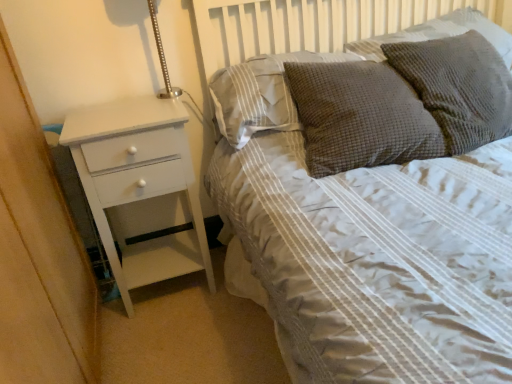
The image size is (512, 384). Describe the element at coordinates (458, 87) in the screenshot. I see `textured gray pillow at upper right, the 2th pillow positioned from the right` at that location.

Describe the element at coordinates (440, 34) in the screenshot. I see `textured gray pillow at upper right, the 1th pillow when ordered from right to left` at that location.

Describe the element at coordinates (260, 94) in the screenshot. I see `brown textured pillow at upper center, which is the 1th pillow from left to right` at that location.

Identify the location of white painted wood chest of drawers at left. (139, 183).

The height and width of the screenshot is (384, 512). What do you see at coordinates (360, 117) in the screenshot?
I see `brown textured pillow at upper right, which is the 3th pillow in right-to-left order` at bounding box center [360, 117].

Locate an element on the screen. This screenshot has width=512, height=384. textured gray pillow at upper right, the 2th pillow positioned from the right is located at coordinates [458, 87].

Is white painted wood chest of drawers at left facing towards brown textured pillow at upper center, which is the 1th pillow from left to right?

No, white painted wood chest of drawers at left does not turn towards brown textured pillow at upper center, which is the 1th pillow from left to right.

Does white painted wood chest of drawers at left lie behind brown textured pillow at upper center, which is the 1th pillow from left to right?

No, it is in front of brown textured pillow at upper center, which is the 1th pillow from left to right.

From a real-world perspective, is white painted wood chest of drawers at left located higher than brown textured pillow at upper center, which is counted as the fourth pillow, starting from the right?

No.

Which of these two, brown textured pillow at upper right, placed as the 2th pillow when sorted from left to right, or brown textured pillow at upper center, which is the 1th pillow from left to right, stands taller?

With more height is brown textured pillow at upper right, placed as the 2th pillow when sorted from left to right.

Consider the image. Is brown textured pillow at upper right, which is the 3th pillow in right-to-left order, to the left of brown textured pillow at upper center, which is counted as the fourth pillow, starting from the right, from the viewer's perspective?

Incorrect, brown textured pillow at upper right, which is the 3th pillow in right-to-left order, is not on the left side of brown textured pillow at upper center, which is counted as the fourth pillow, starting from the right.

Is point (415, 104) closer to camera compared to point (260, 125)?

Yes, it is in front of point (260, 125).

Considering the sizes of textured gray pillow at upper right, the 1th pillow when ordered from right to left, and textured gray pillow at upper right, the 2th pillow positioned from the right, in the image, is textured gray pillow at upper right, the 1th pillow when ordered from right to left, taller or shorter than textured gray pillow at upper right, the 2th pillow positioned from the right,?

Clearly, textured gray pillow at upper right, the 1th pillow when ordered from right to left, is shorter compared to textured gray pillow at upper right, the 2th pillow positioned from the right.

Does textured gray pillow at upper right, the 1th pillow when ordered from right to left, appear on the right side of textured gray pillow at upper right, the 2th pillow positioned from the right?

Correct, you'll find textured gray pillow at upper right, the 1th pillow when ordered from right to left, to the right of textured gray pillow at upper right, the 2th pillow positioned from the right.

Is point (454, 28) farther from camera compared to point (415, 88)?

Yes, it is.

How different are the orientations of textured gray pillow at upper right, the 4th pillow viewed from the left, and textured gray pillow at upper right, the 2th pillow positioned from the right, in degrees?

The angular difference between textured gray pillow at upper right, the 4th pillow viewed from the left, and textured gray pillow at upper right, the 2th pillow positioned from the right, is 7.82 degrees.

Which object is positioned more to the left, white painted wood chest of drawers at left or textured gray pillow at upper right, the 4th pillow viewed from the left?

white painted wood chest of drawers at left is more to the left.

Is white painted wood chest of drawers at left aimed at textured gray pillow at upper right, the 1th pillow when ordered from right to left?

No, white painted wood chest of drawers at left is not oriented towards textured gray pillow at upper right, the 1th pillow when ordered from right to left.

Is point (83, 114) more distant than point (471, 9)?

No.

Which of these two, white painted wood chest of drawers at left or textured gray pillow at upper right, the 4th pillow viewed from the left, stands shorter?

With less height is textured gray pillow at upper right, the 4th pillow viewed from the left.

Which of these two, brown textured pillow at upper center, which is counted as the fourth pillow, starting from the right, or textured gray pillow at upper right, positioned as the 3th pillow in left-to-right order, stands shorter?

brown textured pillow at upper center, which is counted as the fourth pillow, starting from the right.

Is brown textured pillow at upper center, which is counted as the fourth pillow, starting from the right, oriented away from textured gray pillow at upper right, positioned as the 3th pillow in left-to-right order?

No, brown textured pillow at upper center, which is counted as the fourth pillow, starting from the right, is not facing the opposite direction of textured gray pillow at upper right, positioned as the 3th pillow in left-to-right order.

Between point (290, 115) and point (410, 42), which one is positioned behind?

Positioned behind is point (290, 115).

Where is `the 2nd pillow counting from the right side of the brown textured pillow at upper center, which is counted as the fourth pillow, starting from the right`? Image resolution: width=512 pixels, height=384 pixels. the 2nd pillow counting from the right side of the brown textured pillow at upper center, which is counted as the fourth pillow, starting from the right is located at coordinates (458, 87).

Is brown textured pillow at upper center, which is the 1th pillow from left to right, looking in the opposite direction of brown textured pillow at upper right, which is the 3th pillow in right-to-left order?

No.

Is point (229, 95) positioned before point (390, 121)?

No.

Considering the sizes of objects brown textured pillow at upper center, which is the 1th pillow from left to right, and brown textured pillow at upper right, placed as the 2th pillow when sorted from left to right, in the image provided, who is thinner, brown textured pillow at upper center, which is the 1th pillow from left to right, or brown textured pillow at upper right, placed as the 2th pillow when sorted from left to right,?

brown textured pillow at upper center, which is the 1th pillow from left to right, is thinner.

In the image, is brown textured pillow at upper center, which is the 1th pillow from left to right, on the left side or the right side of brown textured pillow at upper right, which is the 3th pillow in right-to-left order?

In the image, brown textured pillow at upper center, which is the 1th pillow from left to right, appears on the left side of brown textured pillow at upper right, which is the 3th pillow in right-to-left order.

Is the position of brown textured pillow at upper right, which is the 3th pillow in right-to-left order, less distant than that of textured gray pillow at upper right, the 2th pillow positioned from the right?

No, the depth of brown textured pillow at upper right, which is the 3th pillow in right-to-left order, is greater than that of textured gray pillow at upper right, the 2th pillow positioned from the right.

Could you tell me if brown textured pillow at upper right, which is the 3th pillow in right-to-left order, is turned towards textured gray pillow at upper right, positioned as the 3th pillow in left-to-right order?

No, brown textured pillow at upper right, which is the 3th pillow in right-to-left order, is not oriented towards textured gray pillow at upper right, positioned as the 3th pillow in left-to-right order.

From the picture: Can you confirm if brown textured pillow at upper right, placed as the 2th pillow when sorted from left to right, is thinner than textured gray pillow at upper right, the 2th pillow positioned from the right?

No, brown textured pillow at upper right, placed as the 2th pillow when sorted from left to right, is not thinner than textured gray pillow at upper right, the 2th pillow positioned from the right.

From the textured gray pillow at upper right, the 2th pillow positioned from the right, count 1st pillows backward and point to it. Please provide its 2D coordinates.

[(360, 117)]

At what (x,y) coordinates should I click in order to perform the action: click on the chest of drawers lying below the brown textured pillow at upper center, which is counted as the fourth pillow, starting from the right (from the image's perspective). Please return your answer as a coordinate pair (x, y). This screenshot has width=512, height=384. Looking at the image, I should click on (139, 183).

At what (x,y) coordinates should I click in order to perform the action: click on pillow that is the 2nd one below the brown textured pillow at upper center, which is counted as the fourth pillow, starting from the right (from a real-world perspective). Please return your answer as a coordinate pair (x, y). Looking at the image, I should click on (360, 117).

Which object lies further to the anchor point textured gray pillow at upper right, positioned as the 3th pillow in left-to-right order, textured gray pillow at upper right, the 4th pillow viewed from the left, or brown textured pillow at upper right, placed as the 2th pillow when sorted from left to right?

textured gray pillow at upper right, the 4th pillow viewed from the left, is positioned further to the anchor textured gray pillow at upper right, positioned as the 3th pillow in left-to-right order.

Looking at the image, which one is located further to textured gray pillow at upper right, the 2th pillow positioned from the right, brown textured pillow at upper center, which is the 1th pillow from left to right, or white painted wood chest of drawers at left?

white painted wood chest of drawers at left.

Which object lies further to the anchor point textured gray pillow at upper right, positioned as the 3th pillow in left-to-right order, textured gray pillow at upper right, the 1th pillow when ordered from right to left, or brown textured pillow at upper center, which is the 1th pillow from left to right?

brown textured pillow at upper center, which is the 1th pillow from left to right.

Considering their positions, is brown textured pillow at upper center, which is counted as the fourth pillow, starting from the right, positioned further to textured gray pillow at upper right, the 1th pillow when ordered from right to left, than brown textured pillow at upper right, which is the 3th pillow in right-to-left order?

The object further to textured gray pillow at upper right, the 1th pillow when ordered from right to left, is brown textured pillow at upper center, which is counted as the fourth pillow, starting from the right.

Looking at the image, which one is located further to brown textured pillow at upper right, placed as the 2th pillow when sorted from left to right, textured gray pillow at upper right, the 1th pillow when ordered from right to left, or white painted wood chest of drawers at left?

white painted wood chest of drawers at left is further to brown textured pillow at upper right, placed as the 2th pillow when sorted from left to right.

Consider the image. Based on their spatial positions, is brown textured pillow at upper right, which is the 3th pillow in right-to-left order, or white painted wood chest of drawers at left further from brown textured pillow at upper center, which is counted as the fourth pillow, starting from the right?

The object further to brown textured pillow at upper center, which is counted as the fourth pillow, starting from the right, is white painted wood chest of drawers at left.

When comparing their distances from white painted wood chest of drawers at left, does textured gray pillow at upper right, positioned as the 3th pillow in left-to-right order, or brown textured pillow at upper center, which is counted as the fourth pillow, starting from the right, seem further?

textured gray pillow at upper right, positioned as the 3th pillow in left-to-right order, lies further to white painted wood chest of drawers at left than the other object.

Estimate the real-world distances between objects in this image. Which object is further from textured gray pillow at upper right, the 2th pillow positioned from the right, brown textured pillow at upper right, placed as the 2th pillow when sorted from left to right, or textured gray pillow at upper right, the 1th pillow when ordered from right to left?

textured gray pillow at upper right, the 1th pillow when ordered from right to left.

You are a GUI agent. You are given a task and a screenshot of the screen. Output one action in this format:
    pyautogui.click(x=<x>, y=<y>)
    Task: Click on the pillow situated between white painted wood chest of drawers at left and brown textured pillow at upper right, which is the 3th pillow in right-to-left order, from left to right
    The height and width of the screenshot is (384, 512).
    Given the screenshot: What is the action you would take?
    pyautogui.click(x=260, y=94)

Where is `pillow between brown textured pillow at upper center, which is counted as the fourth pillow, starting from the right, and textured gray pillow at upper right, positioned as the 3th pillow in left-to-right order`? pillow between brown textured pillow at upper center, which is counted as the fourth pillow, starting from the right, and textured gray pillow at upper right, positioned as the 3th pillow in left-to-right order is located at coordinates (360, 117).

Where is `pillow between brown textured pillow at upper right, placed as the 2th pillow when sorted from left to right, and textured gray pillow at upper right, the 4th pillow viewed from the left, in the horizontal direction`? Image resolution: width=512 pixels, height=384 pixels. pillow between brown textured pillow at upper right, placed as the 2th pillow when sorted from left to right, and textured gray pillow at upper right, the 4th pillow viewed from the left, in the horizontal direction is located at coordinates (458, 87).